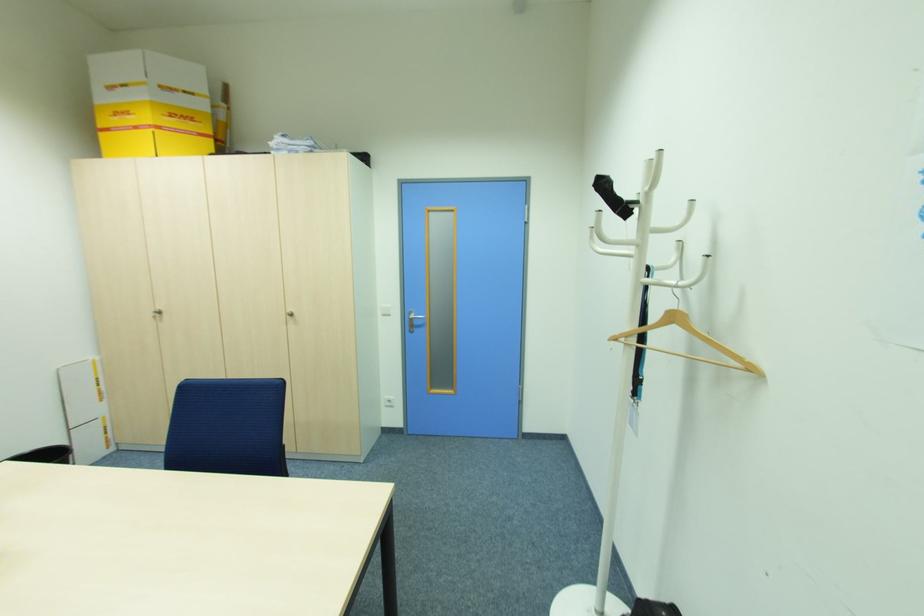
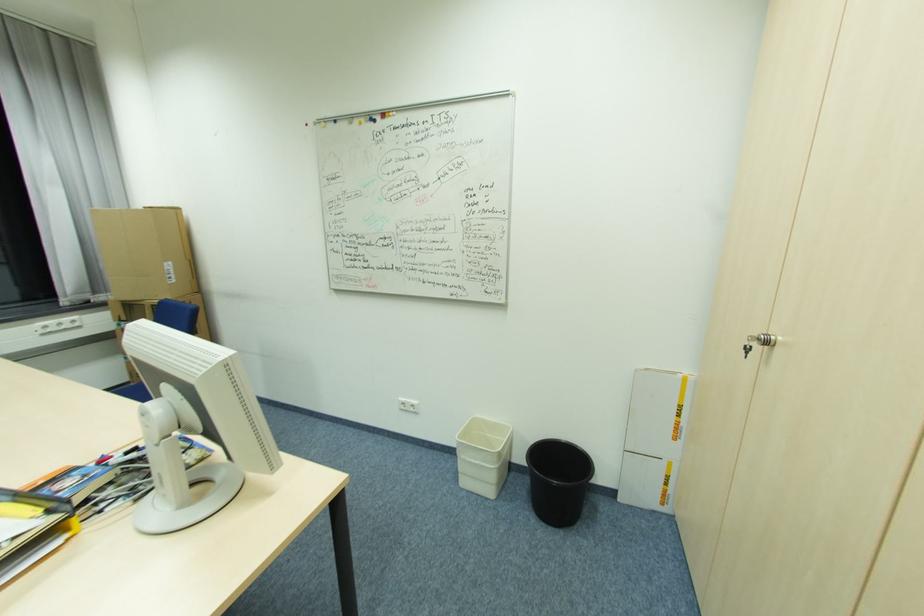
The point at [162,312] is marked in the first image. Where is the corresponding point in the second image?

(772, 344)